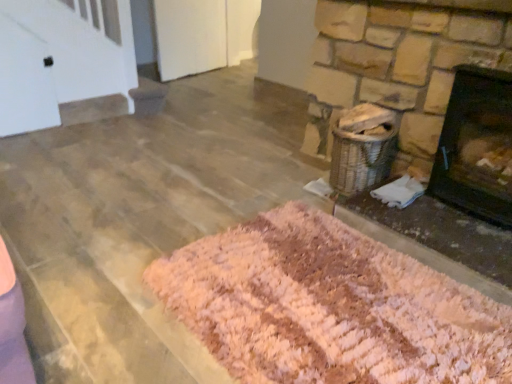
Question: Considering the relative sizes of pink shaggy rug at lower center and black matte fireplace at right in the image provided, is pink shaggy rug at lower center smaller than black matte fireplace at right?

Choices:
 (A) yes
 (B) no

Answer: (B)

Question: Can you confirm if pink shaggy rug at lower center is positioned to the right of black matte fireplace at right?

Choices:
 (A) no
 (B) yes

Answer: (A)

Question: Are pink shaggy rug at lower center and black matte fireplace at right located far from each other?

Choices:
 (A) yes
 (B) no

Answer: (B)

Question: From a real-world perspective, is pink shaggy rug at lower center below black matte fireplace at right?

Choices:
 (A) no
 (B) yes

Answer: (B)

Question: Is pink shaggy rug at lower center outside of black matte fireplace at right?

Choices:
 (A) no
 (B) yes

Answer: (B)

Question: From a real-world perspective, is pink shaggy rug at lower center on top of black matte fireplace at right?

Choices:
 (A) yes
 (B) no

Answer: (B)

Question: Is pink shag rug at lower right shorter than pink shaggy rug at lower center?

Choices:
 (A) no
 (B) yes

Answer: (A)

Question: Is pink shag rug at lower right with pink shaggy rug at lower center?

Choices:
 (A) no
 (B) yes

Answer: (A)

Question: Does pink shag rug at lower right contain pink shaggy rug at lower center?

Choices:
 (A) no
 (B) yes

Answer: (A)

Question: From the image's perspective, is pink shag rug at lower right located beneath pink shaggy rug at lower center?

Choices:
 (A) yes
 (B) no

Answer: (B)

Question: Can you confirm if pink shag rug at lower right is positioned to the right of pink shaggy rug at lower center?

Choices:
 (A) no
 (B) yes

Answer: (B)

Question: Is pink shaggy rug at lower center at the back of pink shag rug at lower right?

Choices:
 (A) yes
 (B) no

Answer: (B)

Question: Considering the relative positions of black matte fireplace at right and pink shag rug at lower right in the image provided, is black matte fireplace at right in front of pink shag rug at lower right?

Choices:
 (A) no
 (B) yes

Answer: (A)